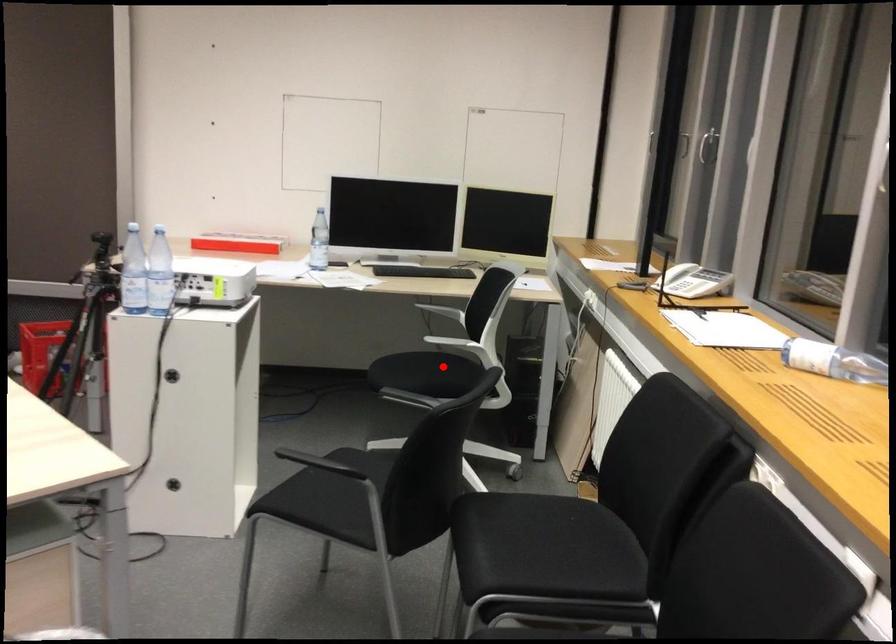
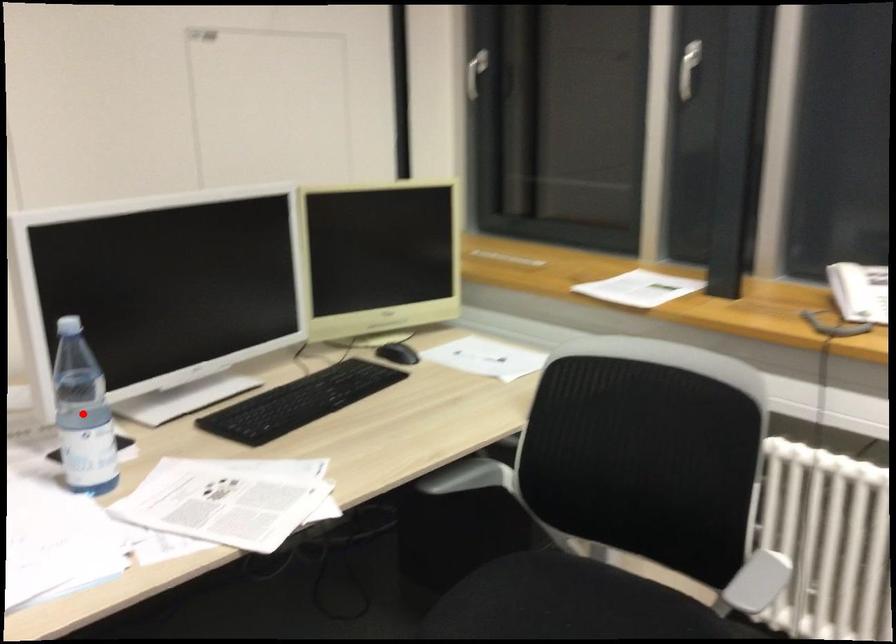
Based on the photo, I am providing you with two images of the same scene from different viewpoints. A red point is marked on the first image and another point is marked on the second image. Are the points marked in image1 and image2 representing the same 3D position?

No